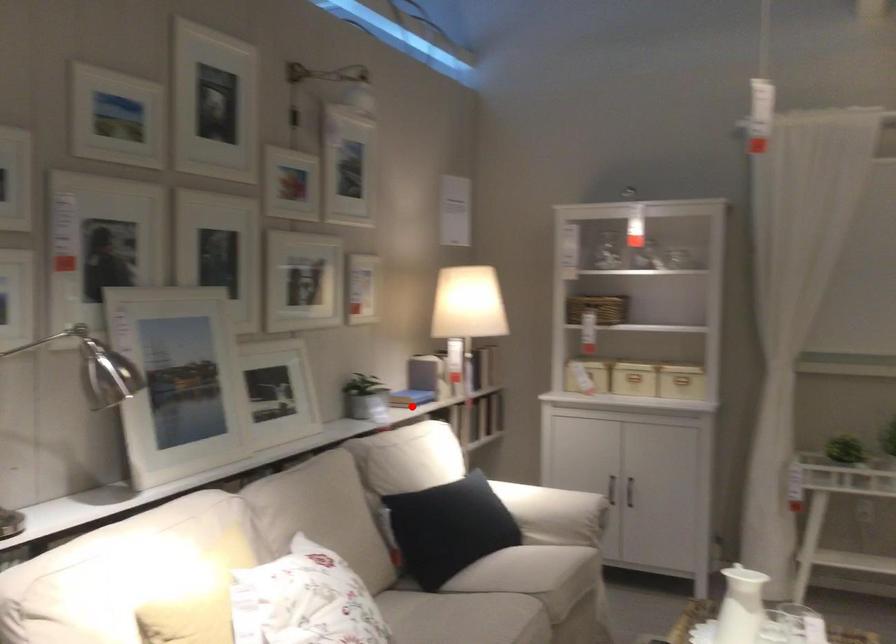
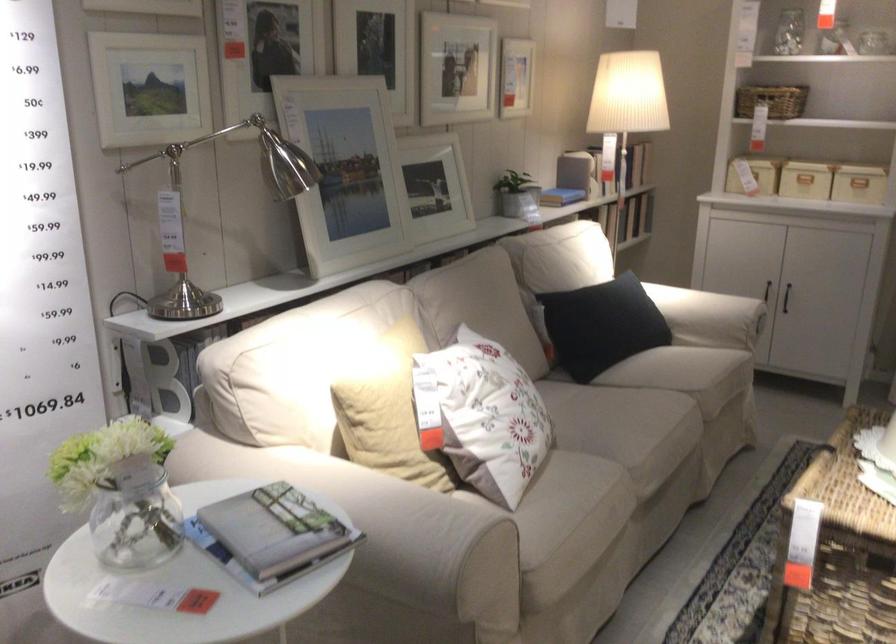
In the second image, find the point that corresponds to the highlighted location in the first image.

(561, 194)